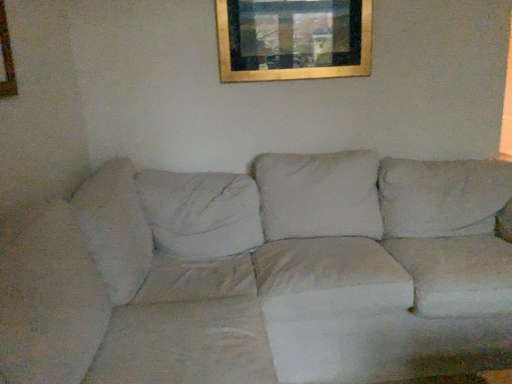
Question: From their relative heights in the image, would you say white fabric couch at center is taller or shorter than gold metallic picture frame at upper center?

Choices:
 (A) short
 (B) tall

Answer: (B)

Question: Visually, is white fabric couch at center positioned to the left or to the right of gold metallic picture frame at upper center?

Choices:
 (A) left
 (B) right

Answer: (A)

Question: Is white fabric couch at center inside the boundaries of gold metallic picture frame at upper center, or outside?

Choices:
 (A) inside
 (B) outside

Answer: (B)

Question: Looking at their shapes, would you say gold metallic picture frame at upper center is wider or thinner than white fabric couch at center?

Choices:
 (A) wide
 (B) thin

Answer: (B)

Question: Is point (245, 62) closer or farther from the camera than point (57, 299)?

Choices:
 (A) closer
 (B) farther

Answer: (B)

Question: Is gold metallic picture frame at upper center inside the boundaries of white fabric couch at center, or outside?

Choices:
 (A) outside
 (B) inside

Answer: (A)

Question: Relative to white fabric couch at center, is gold metallic picture frame at upper center in front or behind?

Choices:
 (A) front
 (B) behind

Answer: (B)